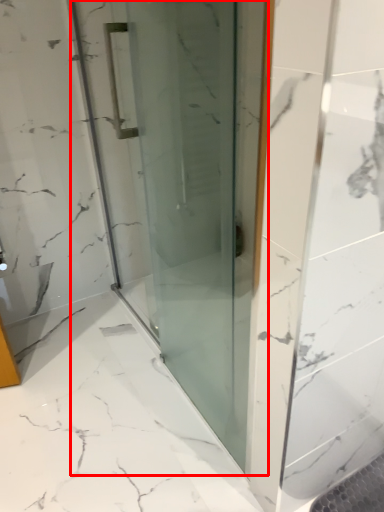
Question: From the image, what is the correct spatial relationship of door (annotated by the red box) in relation to bath?

Choices:
 (A) left
 (B) right

Answer: (A)